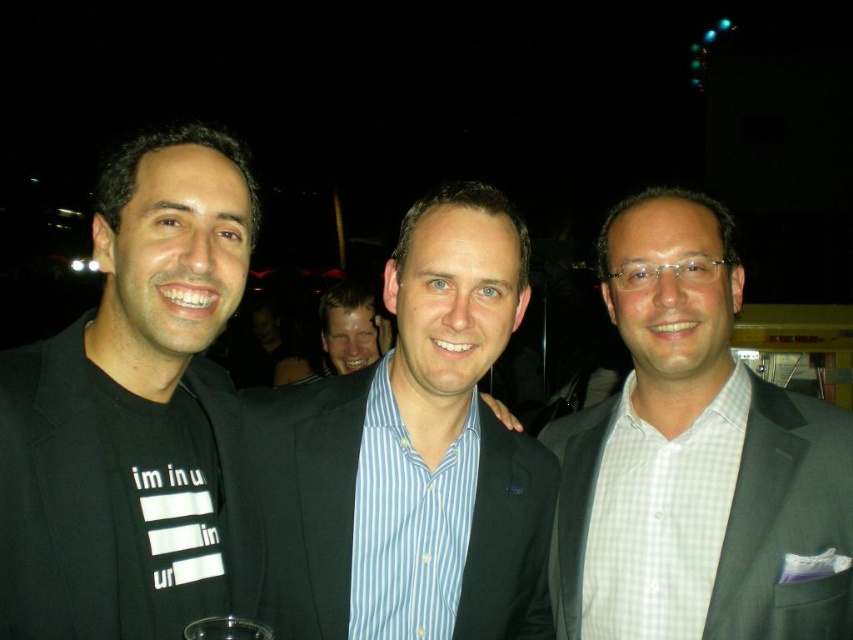
You are a photographer trying to adjust the lighting for a group photo. You notice two shirts in the center of the image, a blue striped shirt at center and a gray checkered shirt at center. Which shirt is closer to the camera?

The blue striped shirt at center is positioned under the gray checkered shirt at center, so the gray checkered shirt at center is closer to the camera.

Based on the scene description, which object is positioned to the left of the other between the black matte suit at center and the gray checkered shirt at center?

The black matte suit at center is positioned to the left of the gray checkered shirt at center.